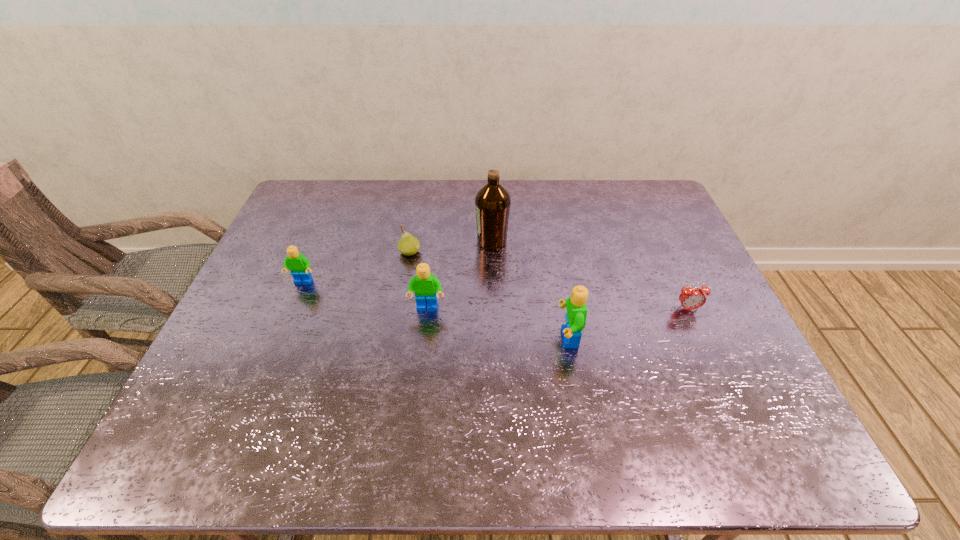
At what (x,y) coordinates should I click in order to perform the action: click on unoccupied area between the fourth nearest object and the tallest object. Please return your answer as a coordinate pair (x, y). This screenshot has width=960, height=540. Looking at the image, I should click on (397, 262).

The height and width of the screenshot is (540, 960). I want to click on vacant region between the pear and the alarm clock, so click(549, 281).

Where is `free area in between the third object from right to left and the third tallest object`? Image resolution: width=960 pixels, height=540 pixels. free area in between the third object from right to left and the third tallest object is located at coordinates (460, 275).

Locate an element on the screen. This screenshot has height=540, width=960. free point between the pear and the leftmost object is located at coordinates [356, 267].

Where is `free point between the pear and the rightmost object`? The width and height of the screenshot is (960, 540). free point between the pear and the rightmost object is located at coordinates (549, 281).

The width and height of the screenshot is (960, 540). I want to click on object that is the second nearest to the tallest object, so click(x=425, y=286).

Locate which object is the fourth closest to the rightmost object. Please provide its 2D coordinates. Your answer should be formatted as a tuple, i.e. [(x, y)], where the tuple contains the x and y coordinates of a point satisfying the conditions above.

[(408, 245)]

Where is `Lego that is the closest to the rightmost object`? This screenshot has width=960, height=540. Lego that is the closest to the rightmost object is located at coordinates (576, 315).

Identify the location of Lego that is the second nearest to the third object from right to left. The height and width of the screenshot is (540, 960). (576, 315).

Identify the location of free space that satisfies the following two spatial constraints: 1. on the label of the tallest object; 2. on the face of the second shortest Lego. This screenshot has height=540, width=960. (494, 308).